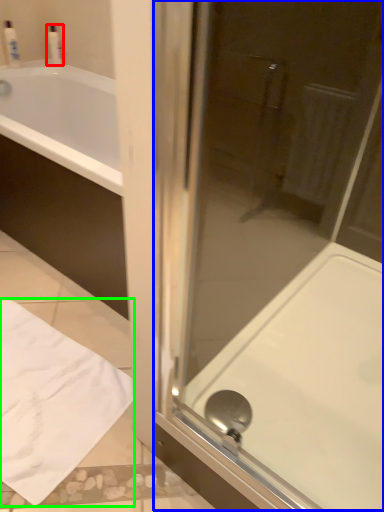
Question: Which object is the closest to the toiletry (highlighted by a red box)? Choose among these: screen door (highlighted by a blue box) or sheet (highlighted by a green box).

Choices:
 (A) screen door
 (B) sheet

Answer: (B)